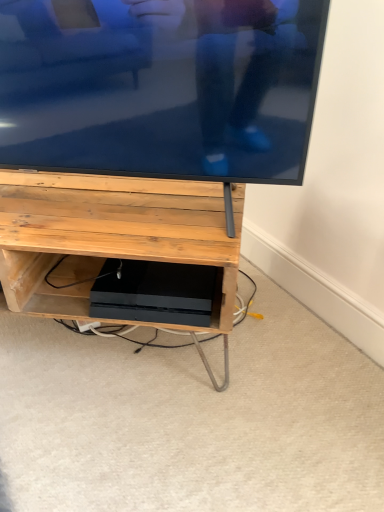
Question: Is matte black tv at upper center placed right next to matte wood shelf at center?

Choices:
 (A) no
 (B) yes

Answer: (A)

Question: Does matte black tv at upper center have a greater width compared to matte wood shelf at center?

Choices:
 (A) yes
 (B) no

Answer: (B)

Question: Is matte black tv at upper center positioned beyond the bounds of matte wood shelf at center?

Choices:
 (A) yes
 (B) no

Answer: (A)

Question: Is matte black tv at upper center at the left side of matte wood shelf at center?

Choices:
 (A) yes
 (B) no

Answer: (B)

Question: Does matte black tv at upper center have a lesser width compared to matte wood shelf at center?

Choices:
 (A) yes
 (B) no

Answer: (A)

Question: Considering the positions of point (87, 179) and point (190, 118), is point (87, 179) closer or farther from the camera than point (190, 118)?

Choices:
 (A) closer
 (B) farther

Answer: (B)

Question: Is matte wood shelf at center to the left or to the right of matte black tv at upper center in the image?

Choices:
 (A) left
 (B) right

Answer: (A)

Question: Considering the positions of matte wood shelf at center and matte black tv at upper center in the image, is matte wood shelf at center taller or shorter than matte black tv at upper center?

Choices:
 (A) tall
 (B) short

Answer: (B)

Question: Is matte wood shelf at center bigger or smaller than matte black tv at upper center?

Choices:
 (A) big
 (B) small

Answer: (A)

Question: Considering the positions of point (221, 326) and point (304, 39), is point (221, 326) closer or farther from the camera than point (304, 39)?

Choices:
 (A) farther
 (B) closer

Answer: (A)

Question: Looking at their shapes, would you say black matte console at center is wider or thinner than matte black tv at upper center?

Choices:
 (A) thin
 (B) wide

Answer: (B)

Question: Is black matte console at center in front of or behind matte black tv at upper center in the image?

Choices:
 (A) front
 (B) behind

Answer: (B)

Question: From the image's perspective, is black matte console at center located above or below matte black tv at upper center?

Choices:
 (A) below
 (B) above

Answer: (A)

Question: Which is correct: matte black tv at upper center is inside black matte console at center, or outside of it?

Choices:
 (A) inside
 (B) outside

Answer: (B)

Question: Is matte black tv at upper center taller or shorter than black matte console at center?

Choices:
 (A) tall
 (B) short

Answer: (A)